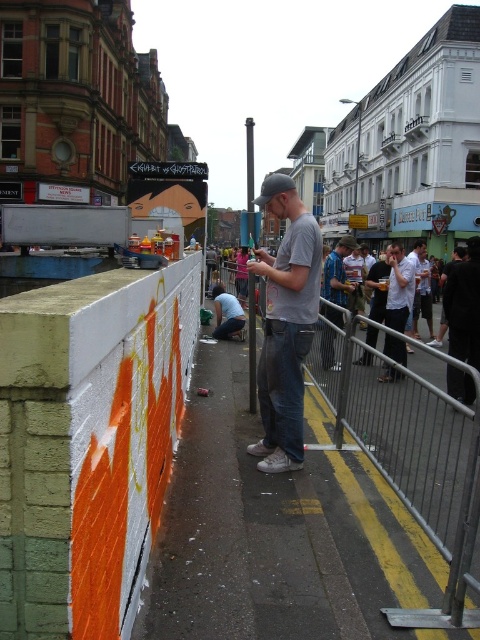
Question: Can you confirm if white painted concrete wall at left is wider than gray matte t-shirt at center?

Choices:
 (A) no
 (B) yes

Answer: (A)

Question: Is white painted concrete wall at left thinner than white shirt at center?

Choices:
 (A) no
 (B) yes

Answer: (B)

Question: Which point is farther from the camera taking this photo?

Choices:
 (A) (277, 404)
 (B) (251, 483)
 (C) (398, 310)

Answer: (C)

Question: Which object is closer to the camera taking this photo?

Choices:
 (A) concrete sidewalk at center
 (B) blue denim jeans at center
 (C) white shirt at center
 (D) white painted concrete wall at left

Answer: (D)

Question: Does concrete sidewalk at center appear on the left side of white shirt at center?

Choices:
 (A) yes
 (B) no

Answer: (A)

Question: Which object appears farthest from the camera in this image?

Choices:
 (A) gray matte t-shirt at center
 (B) concrete sidewalk at center
 (C) white shirt at center
 (D) dark gray fabric jacket at center

Answer: (D)